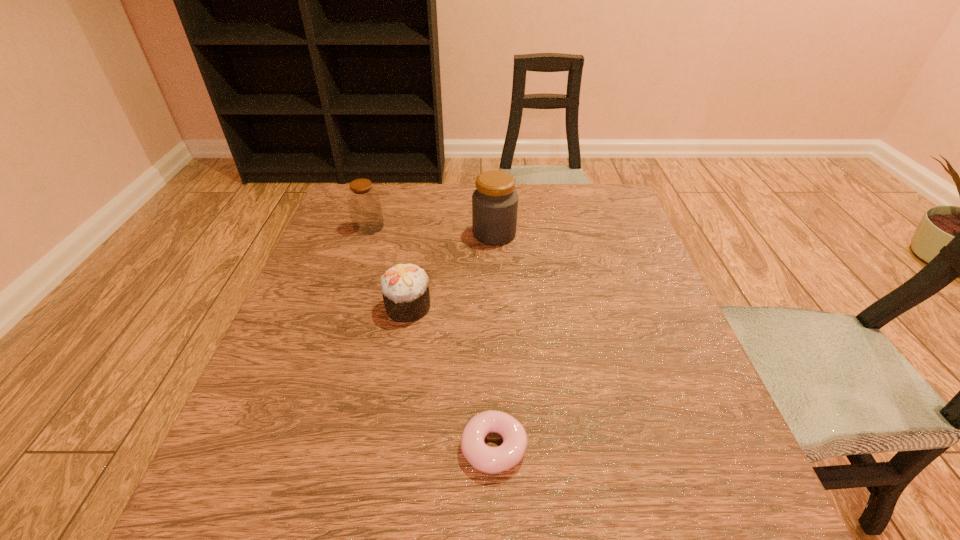
You are a GUI agent. You are given a task and a screenshot of the screen. Output one action in this format:
    pyautogui.click(x=<x>, y=<y>)
    Task: Click on the free spot between the right jar and the third shortest object
    This screenshot has width=960, height=540.
    Given the screenshot: What is the action you would take?
    pyautogui.click(x=431, y=230)

Where is `vacant region between the second nearest object and the third shortest object`? The image size is (960, 540). vacant region between the second nearest object and the third shortest object is located at coordinates (388, 267).

Image resolution: width=960 pixels, height=540 pixels. I want to click on free space between the right jar and the doughnut, so click(x=493, y=341).

The height and width of the screenshot is (540, 960). I want to click on vacant area that lies between the right jar and the left jar, so click(x=431, y=230).

At what (x,y) coordinates should I click in order to perform the action: click on object that is the third closest one to the left jar. Please return your answer as a coordinate pair (x, y). This screenshot has width=960, height=540. Looking at the image, I should click on (490, 460).

The image size is (960, 540). What are the coordinates of `object that can be found as the third closest to the third object from right to left` in the screenshot? It's located at (490, 460).

At what (x,y) coordinates should I click in order to perform the action: click on free space in the image that satisfies the following two spatial constraints: 1. on the front side of the shorter jar; 2. on the right side of the cupcake. Please return your answer as a coordinate pair (x, y). Looking at the image, I should click on (342, 307).